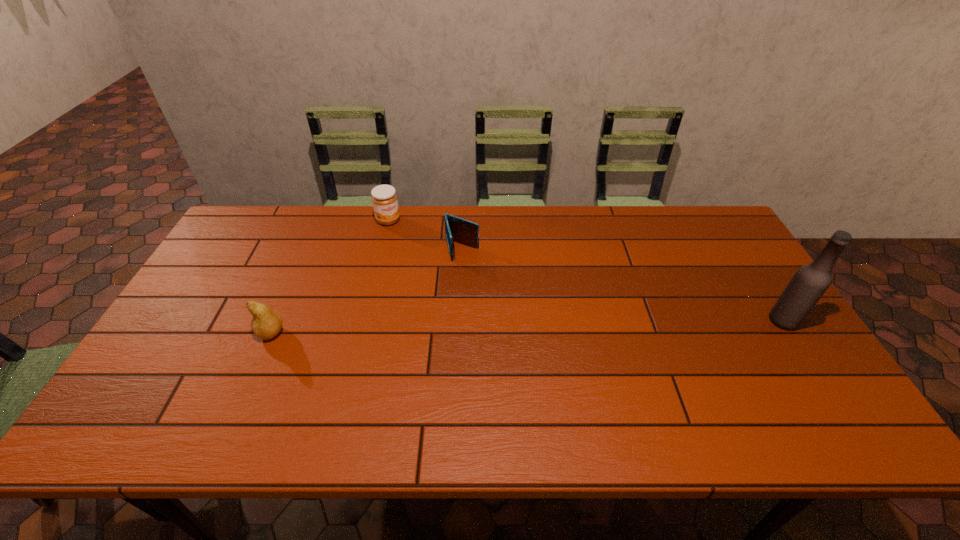
You are a GUI agent. You are given a task and a screenshot of the screen. Output one action in this format:
    pyautogui.click(x=<x>, y=<y>)
    Task: Click on the unoccupied position between the jam and the leftmost object
    
    Given the screenshot: What is the action you would take?
    pyautogui.click(x=330, y=276)

At what (x,y) coordinates should I click in order to perform the action: click on free point between the pear and the shortest object. Please return your answer as a coordinate pair (x, y). Looking at the image, I should click on (367, 291).

Find the location of a particular element. This screenshot has width=960, height=540. free space between the pear and the jam is located at coordinates (330, 276).

At what (x,y) coordinates should I click in order to perform the action: click on object that stands as the second closest to the second object from right to left. Please return your answer as a coordinate pair (x, y). Image resolution: width=960 pixels, height=540 pixels. Looking at the image, I should click on (x=266, y=323).

Identify which object is located as the second nearest to the pear. Please provide its 2D coordinates. Your answer should be formatted as a tuple, i.e. [(x, y)], where the tuple contains the x and y coordinates of a point satisfying the conditions above.

[(457, 229)]

You are a GUI agent. You are given a task and a screenshot of the screen. Output one action in this format:
    pyautogui.click(x=<x>, y=<y>)
    Task: Click on the blank space that satisfies the following two spatial constraints: 1. on the front side of the beer bottle; 2. on the label of the jam
    
    Given the screenshot: What is the action you would take?
    tap(364, 321)

Locate an element on the screen. Image resolution: width=960 pixels, height=540 pixels. free point that satisfies the following two spatial constraints: 1. on the front side of the rightmost object; 2. on the label of the third object from right to left is located at coordinates (364, 321).

Locate an element on the screen. vacant space that satisfies the following two spatial constraints: 1. on the back side of the pear; 2. on the label of the tallest object is located at coordinates (276, 321).